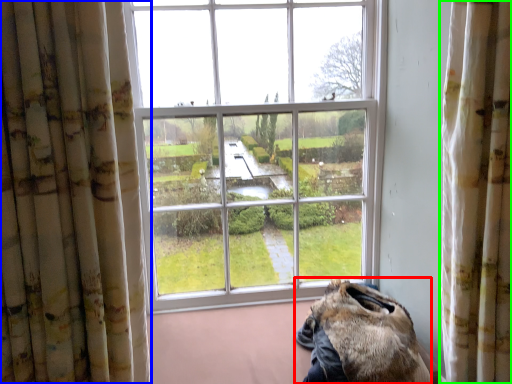
Question: Which object is positioned closest to animal (highlighted by a red box)? Select from curtain (highlighted by a blue box) and curtain (highlighted by a green box).

Choices:
 (A) curtain
 (B) curtain

Answer: (B)